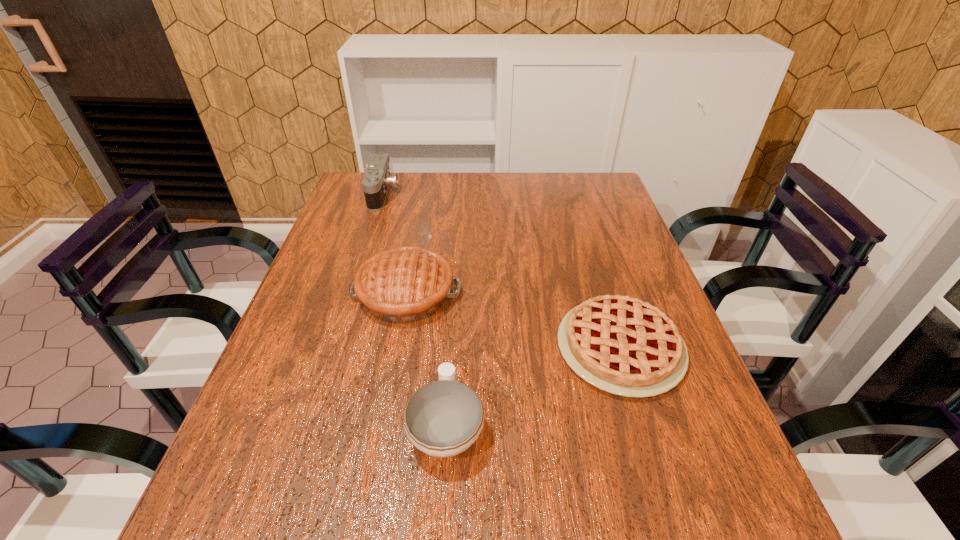
Find the location of a particular element. the farthest object is located at coordinates (377, 180).

Locate an element on the screen. This screenshot has width=960, height=540. the taller pie is located at coordinates (401, 285).

Where is `the second shortest object`? the second shortest object is located at coordinates (443, 418).

Where is `the shortest object`? The width and height of the screenshot is (960, 540). the shortest object is located at coordinates (622, 345).

Identify the location of the right pie. Image resolution: width=960 pixels, height=540 pixels. (622, 345).

I want to click on free space located on the lens of the camera, so pyautogui.click(x=419, y=194).

The height and width of the screenshot is (540, 960). What are the coordinates of `vacant space located on the front of the left pie` in the screenshot? It's located at point(391,375).

Where is `free space located on the side with the handle of the second shortest object`? Image resolution: width=960 pixels, height=540 pixels. free space located on the side with the handle of the second shortest object is located at coordinates (450, 359).

Find the location of a particular element. The image size is (960, 540). vacant space located 0.090m on the side with the handle of the second shortest object is located at coordinates (451, 351).

The image size is (960, 540). Find the location of `vacant space positioned 0.330m on the side with the handle of the second shortest object`. vacant space positioned 0.330m on the side with the handle of the second shortest object is located at coordinates (456, 278).